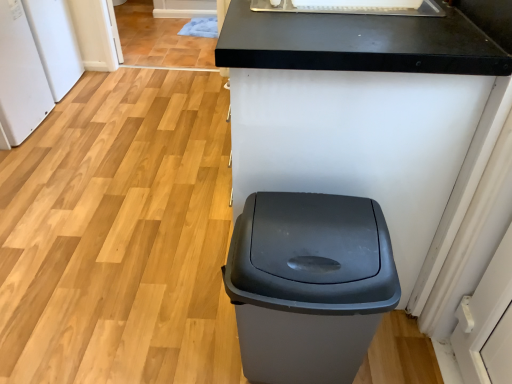
Question: Considering their positions, is matte gray plastic trash can at center located in front of or behind white matte refrigerator at left, arranged as the first appliance when viewed from the front?

Choices:
 (A) front
 (B) behind

Answer: (A)

Question: Is matte gray plastic trash can at center bigger or smaller than white matte refrigerator at left, arranged as the first appliance when viewed from the front?

Choices:
 (A) big
 (B) small

Answer: (B)

Question: Which is nearer to the matte gray plastic trash can at center?

Choices:
 (A) white matte refrigerator at left, arranged as the first appliance when viewed from the front
 (B) white matte refrigerator at left, which appears as the first appliance when viewed from the back
 (C) white glossy sink at upper center
 (D) black matte counter at center

Answer: (D)

Question: Estimate the real-world distances between objects in this image. Which object is closer to the matte gray plastic trash can at center?

Choices:
 (A) white glossy sink at upper center
 (B) white matte refrigerator at left, arranged as the first appliance when viewed from the front
 (C) black matte counter at center
 (D) white matte refrigerator at left, which appears as the first appliance when viewed from the back

Answer: (C)